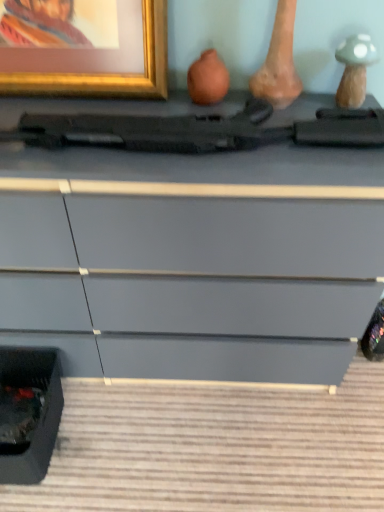
Question: Is matte black gun at center in front of matte gray chest of drawers at center?

Choices:
 (A) no
 (B) yes

Answer: (A)

Question: Considering the relative sizes of matte black gun at center and matte gray chest of drawers at center in the image provided, is matte black gun at center bigger than matte gray chest of drawers at center?

Choices:
 (A) no
 (B) yes

Answer: (A)

Question: Considering the relative sizes of matte black gun at center and matte gray chest of drawers at center in the image provided, is matte black gun at center smaller than matte gray chest of drawers at center?

Choices:
 (A) no
 (B) yes

Answer: (B)

Question: Are matte black gun at center and matte gray chest of drawers at center beside each other?

Choices:
 (A) no
 (B) yes

Answer: (A)

Question: Is matte black gun at center oriented away from matte gray chest of drawers at center?

Choices:
 (A) yes
 (B) no

Answer: (B)

Question: Is matte black gun at center at the right side of matte gray chest of drawers at center?

Choices:
 (A) no
 (B) yes

Answer: (B)

Question: Considering the relative positions of matte gray chest of drawers at center and gold metallic picture frame at upper left in the image provided, is matte gray chest of drawers at center to the right of gold metallic picture frame at upper left from the viewer's perspective?

Choices:
 (A) no
 (B) yes

Answer: (B)

Question: Are matte gray chest of drawers at center and gold metallic picture frame at upper left located far from each other?

Choices:
 (A) no
 (B) yes

Answer: (A)

Question: Is matte gray chest of drawers at center positioned before gold metallic picture frame at upper left?

Choices:
 (A) no
 (B) yes

Answer: (B)

Question: Can you confirm if matte gray chest of drawers at center is shorter than gold metallic picture frame at upper left?

Choices:
 (A) yes
 (B) no

Answer: (B)

Question: From a real-world perspective, is matte gray chest of drawers at center on top of gold metallic picture frame at upper left?

Choices:
 (A) yes
 (B) no

Answer: (B)

Question: Is matte gray chest of drawers at center not within gold metallic picture frame at upper left?

Choices:
 (A) no
 (B) yes

Answer: (B)

Question: Does gold metallic picture frame at upper left have a lesser width compared to matte black gun at center?

Choices:
 (A) yes
 (B) no

Answer: (A)